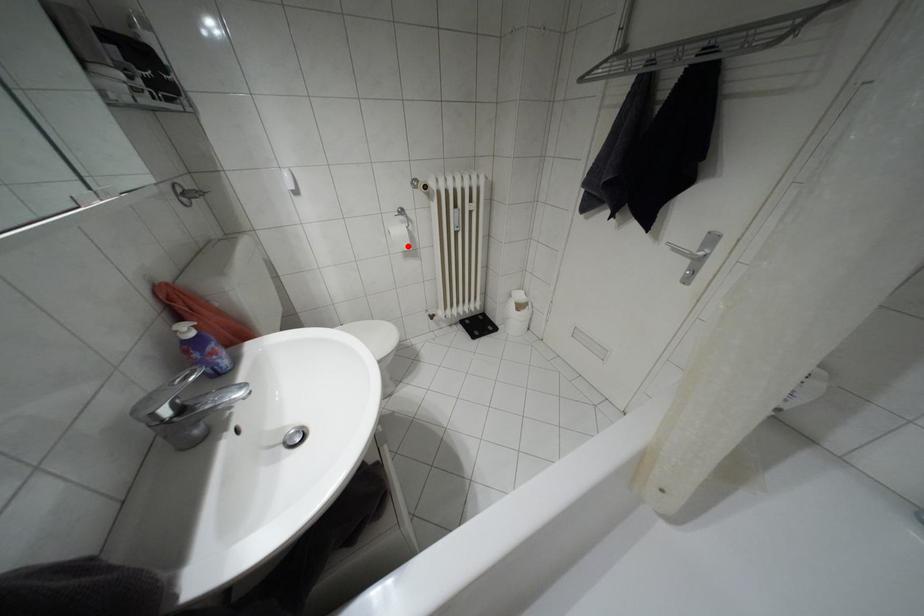
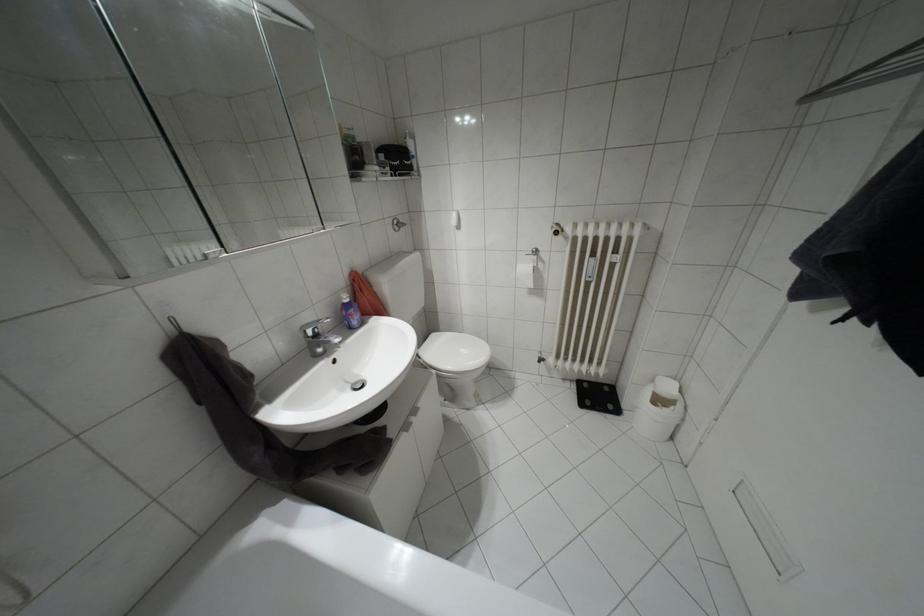
Question: I am providing you with two images of the same scene from different viewpoints. A red point is shown in image1. For the corresponding object point in image2, is it positioned nearer or farther from the camera?

Choices:
 (A) Nearer
 (B) Farther

Answer: (B)